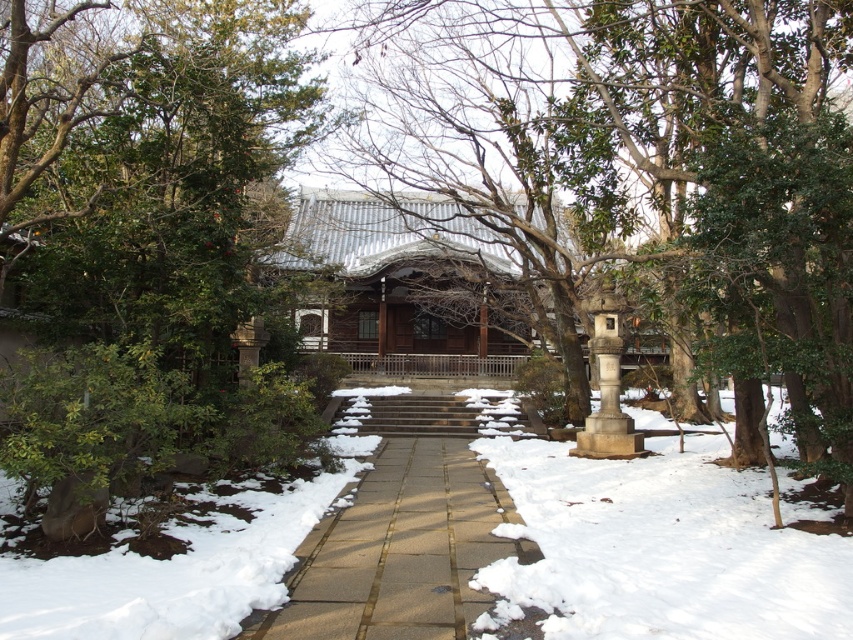
In the scene shown: You are planning to walk along the pathway towards the entrance of the building. There is a green leafy tree at left and a shiny silver gazebo at center in your view. Which object is narrower from your perspective?

The green leafy tree at left is thinner than the shiny silver gazebo at center, so the green leafy tree at left is narrower from your perspective.

You are standing at the entrance of the traditional Japanese building and want to take a photo of the green leafy tree at left. Where should you position yourself to capture the tree in the frame?

The green leafy tree at left is located at point coordinates of 0.267 on the x axis and 0.178 on the y axis, so you should position yourself at the entrance facing towards the coordinates to capture it in the frame.

You are standing at the entrance of the traditional Japanese building and want to walk to the point marked as point (218,182). Which direction should you go relative to the point (294,624)?

You should walk towards the point (218,182), which is behind point (294,624) from your current position at the entrance.